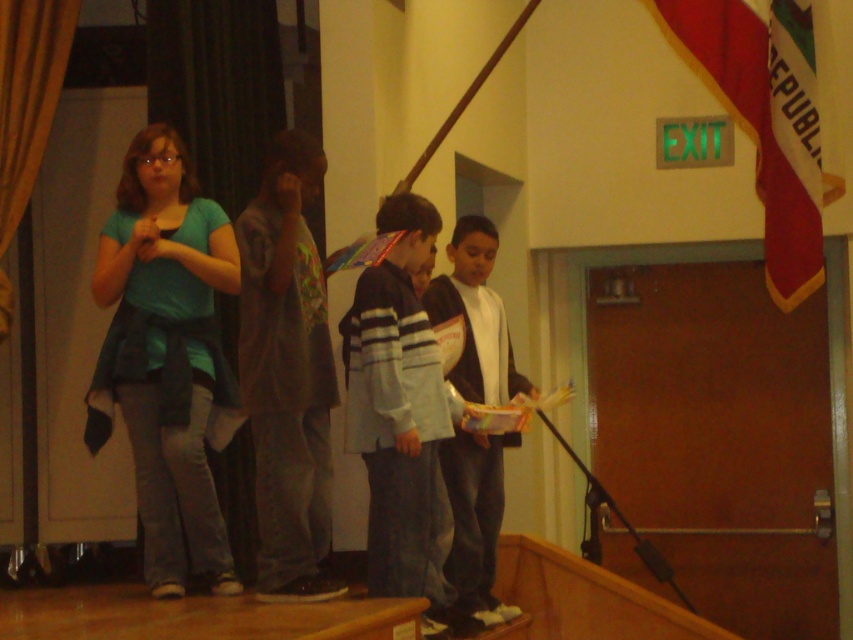
You are a photographer trying to capture a group photo of the children on stage. Since the teal fabric shirt at left is much taller than the striped sweater at center, where should you position them to ensure both are visible in the frame?

To ensure both the teal fabric shirt at left and the striped sweater at center are visible in the frame, position the taller teal fabric shirt at left at the back and the shorter striped sweater at center in the front. This arrangement prevents the taller child from blocking the shorter one.

You are a costume designer preparing for a play and need to ensure that the teal fabric shirt at left and the white matte jacket at center fit on a standard hanger. The hanger can accommodate a maximum width of 40 cm. Given the information provided, can both items fit on separate hangers?

The teal fabric shirt at left has a larger width than the white matte jacket at center. However, since the exact measurements are not provided, it is uncertain if both items individually meet the 40 cm hanger width requirement. Further details about each item are needed to confirm.

You are a photographer in the audience. You want to capture a photo that includes both the striped sweater at center and the red fabric flag at upper right. Based on their positions, can you fit both in the frame without moving your camera? Explain your reasoning.

The striped sweater at center is located below the red fabric flag at upper right, so yes, both can be included in the same frame as long as the camera angle captures the vertical space between them.